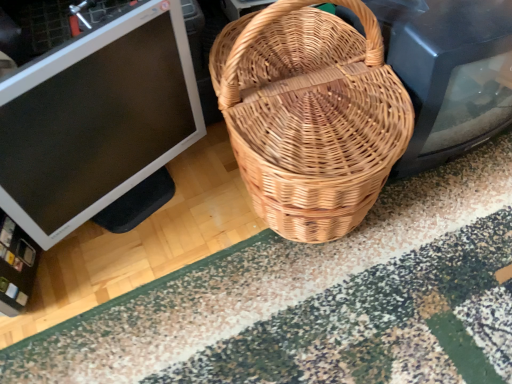
Describe the element at coordinates (298, 316) in the screenshot. The image size is (512, 384). I see `patterned carpet at center` at that location.

Image resolution: width=512 pixels, height=384 pixels. Identify the location of matte black monitor at left. (96, 119).

From a real-world perspective, which is physically below, patterned carpet at center or matte black monitor at left?

patterned carpet at center, from a real-world perspective.

Does patterned carpet at center have a greater width compared to matte black monitor at left?

Yes, patterned carpet at center is wider than matte black monitor at left.

Which is more to the left, patterned carpet at center or matte black monitor at left?

matte black monitor at left.

From the image's perspective, is natural woven picnic basket at center beneath patterned carpet at center?

No.

Is natural woven picnic basket at center smaller than patterned carpet at center?

No, natural woven picnic basket at center is not smaller than patterned carpet at center.

Choose the correct answer: Is natural woven picnic basket at center inside patterned carpet at center or outside it?

natural woven picnic basket at center is outside patterned carpet at center.

How much distance is there between natural woven picnic basket at center and patterned carpet at center?

natural woven picnic basket at center is 9.91 inches from patterned carpet at center.

The width and height of the screenshot is (512, 384). In order to click on picnic basket in front of the patterned carpet at center in this screenshot , I will do `click(310, 115)`.

From the image's perspective, which is below, patterned carpet at center or natural woven picnic basket at center?

patterned carpet at center, from the image's perspective.

Is patterned carpet at center at the left side of natural woven picnic basket at center?

No.

How distant is matte black monitor at left from natural woven picnic basket at center?

matte black monitor at left and natural woven picnic basket at center are 9.12 inches apart from each other.

Choose the correct answer: Is matte black monitor at left inside natural woven picnic basket at center or outside it?

matte black monitor at left is not inside natural woven picnic basket at center, it's outside.

The image size is (512, 384). Find the location of `picnic basket on the right of matte black monitor at left`. picnic basket on the right of matte black monitor at left is located at coordinates (310, 115).

From a real-world perspective, is matte black monitor at left positioned above or below natural woven picnic basket at center?

matte black monitor at left is situated lower than natural woven picnic basket at center in the real world.

Does natural woven picnic basket at center have a lesser width compared to matte black monitor at left?

No.

Is matte black monitor at left a part of natural woven picnic basket at center?

Definitely not — matte black monitor at left is not inside natural woven picnic basket at center.

Does point (390, 74) appear closer or farther from the camera than point (146, 64)?

Point (390, 74) is positioned farther from the camera compared to point (146, 64).

Relative to matte black monitor at left, is natural woven picnic basket at center in front or behind?

natural woven picnic basket at center is positioned closer to the viewer than matte black monitor at left.

Considering the sizes of matte black monitor at left and patterned carpet at center in the image, is matte black monitor at left wider or thinner than patterned carpet at center?

Considering their sizes, matte black monitor at left looks slimmer than patterned carpet at center.

Is patterned carpet at center at the back of matte black monitor at left?

matte black monitor at left is not turned away from patterned carpet at center.

Considering the relative positions of matte black monitor at left and patterned carpet at center in the image provided, is matte black monitor at left to the left of patterned carpet at center from the viewer's perspective?

Correct, you'll find matte black monitor at left to the left of patterned carpet at center.

At what (x,y) coordinates should I click in order to perform the action: click on doormat that is below the matte black monitor at left (from the image's perspective). Please return your answer as a coordinate pair (x, y). This screenshot has width=512, height=384. Looking at the image, I should click on (298, 316).

At what (x,y) coordinates should I click in order to perform the action: click on doormat below the natural woven picnic basket at center (from a real-world perspective). Please return your answer as a coordinate pair (x, y). The height and width of the screenshot is (384, 512). Looking at the image, I should click on (298, 316).

When comparing their distances from natural woven picnic basket at center, does patterned carpet at center or matte black monitor at left seem closer?

Among the two, matte black monitor at left is located nearer to natural woven picnic basket at center.

From the image, which object appears to be nearer to matte black monitor at left, patterned carpet at center or natural woven picnic basket at center?

natural woven picnic basket at center is closer to matte black monitor at left.

Looking at the image, which one is located further to patterned carpet at center, natural woven picnic basket at center or matte black monitor at left?

matte black monitor at left is further to patterned carpet at center.

Considering their positions, is matte black monitor at left positioned further to patterned carpet at center than natural woven picnic basket at center?

The object further to patterned carpet at center is matte black monitor at left.

When comparing their distances from natural woven picnic basket at center, does matte black monitor at left or patterned carpet at center seem further?

patterned carpet at center is positioned further to the anchor natural woven picnic basket at center.

Considering their positions, is natural woven picnic basket at center positioned closer to matte black monitor at left than patterned carpet at center?

Among the two, natural woven picnic basket at center is located nearer to matte black monitor at left.

Locate an element on the screen. picnic basket between matte black monitor at left and patterned carpet at center in the horizontal direction is located at coordinates (310, 115).